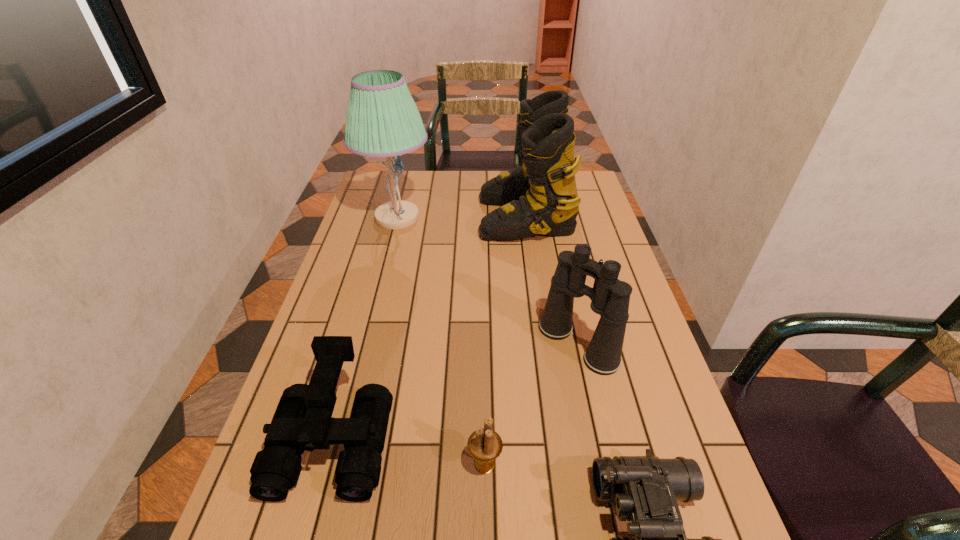
In the image, there is a desktop. Where is `vacant space at the right edge`? This screenshot has width=960, height=540. vacant space at the right edge is located at coordinates tap(599, 318).

The image size is (960, 540). In the image, there is a desktop. What are the coordinates of `blank space at the far right corner` in the screenshot? It's located at (583, 173).

In order to click on free spot between the ski boots and the second tallest binoculars in this screenshot , I will do `click(430, 327)`.

Identify the location of free point between the lamp and the leftmost binoculars. The height and width of the screenshot is (540, 960). (366, 328).

This screenshot has height=540, width=960. Identify the location of free space that is in between the candle holder and the ski boots. (505, 340).

Image resolution: width=960 pixels, height=540 pixels. What are the coordinates of `free space that is in between the tallest object and the fifth shortest object` in the screenshot? It's located at (462, 217).

Locate an element on the screen. Image resolution: width=960 pixels, height=540 pixels. blank region between the leftmost binoculars and the tallest binoculars is located at coordinates (456, 391).

You are a GUI agent. You are given a task and a screenshot of the screen. Output one action in this format:
    pyautogui.click(x=<x>, y=<y>)
    Task: Click on the vacant space in between the candle holder and the fifth shortest object
    The height and width of the screenshot is (540, 960).
    Given the screenshot: What is the action you would take?
    pyautogui.click(x=505, y=340)

Identify the location of object that stands as the fourth closest to the shortest object. The width and height of the screenshot is (960, 540). (540, 197).

Point out which object is positioned as the third nearest to the shortest binoculars. Please provide its 2D coordinates. Your answer should be formatted as a tuple, i.e. [(x, y)], where the tuple contains the x and y coordinates of a point satisfying the conditions above.

[(303, 421)]